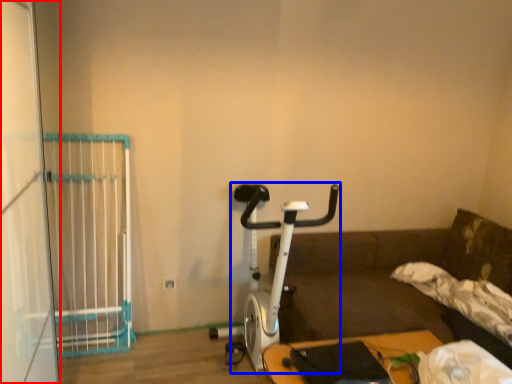
Question: Which of the following is the farthest to the observer, screen door (highlighted by a red box) or stationary bicycle (highlighted by a blue box)?

Choices:
 (A) screen door
 (B) stationary bicycle

Answer: (B)